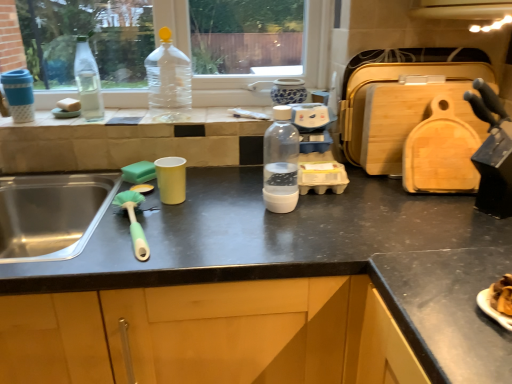
Locate an element on the screen. vacant region to the left of clear glass bottle at left, which is the third bottle in front-to-back order is located at coordinates (48, 121).